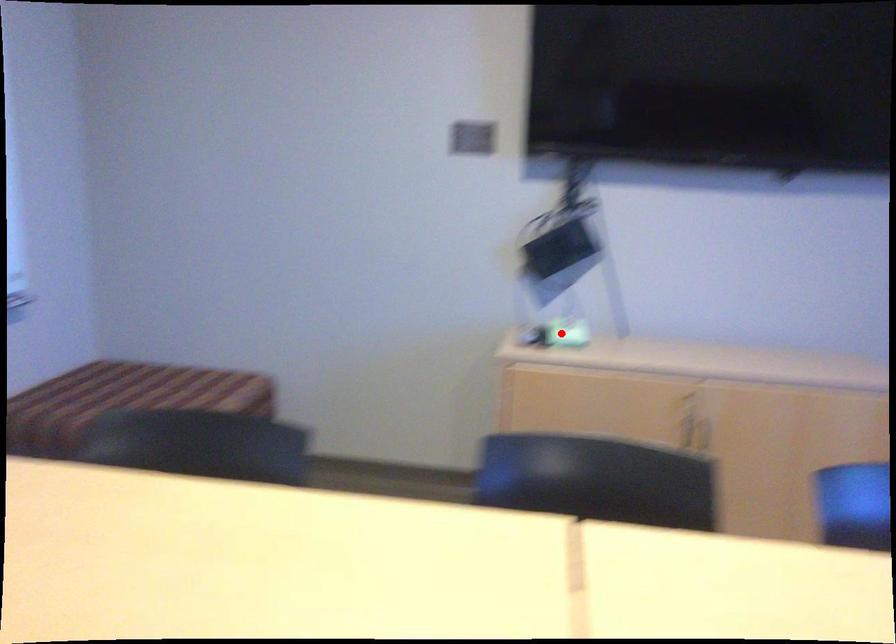
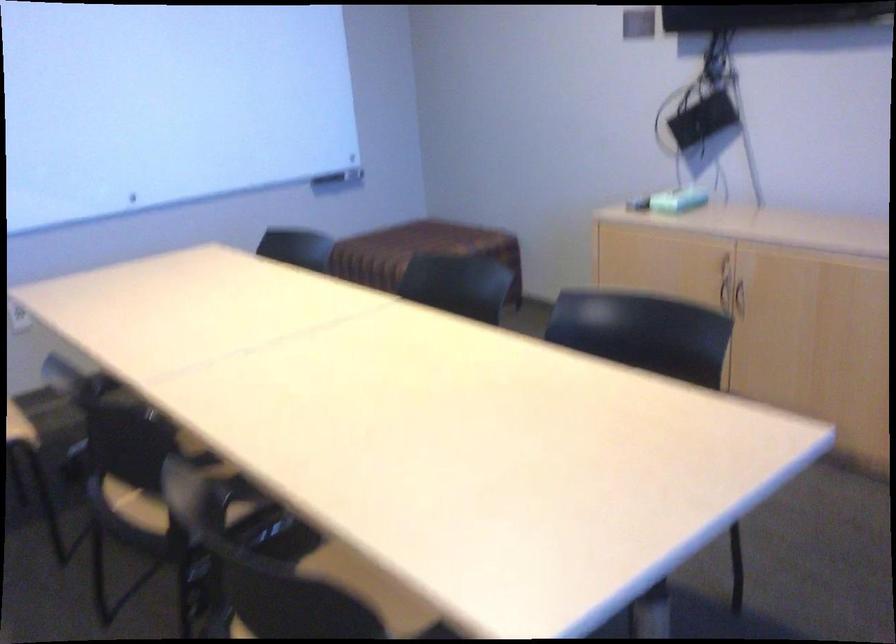
Question: I am providing you with two images of the same scene from different viewpoints. Image1 has a red point marked. In image2, the corresponding 3D location appears at what relative position? Reply with the corresponding letter.

Choices:
 (A) Closer
 (B) Farther

Answer: (B)